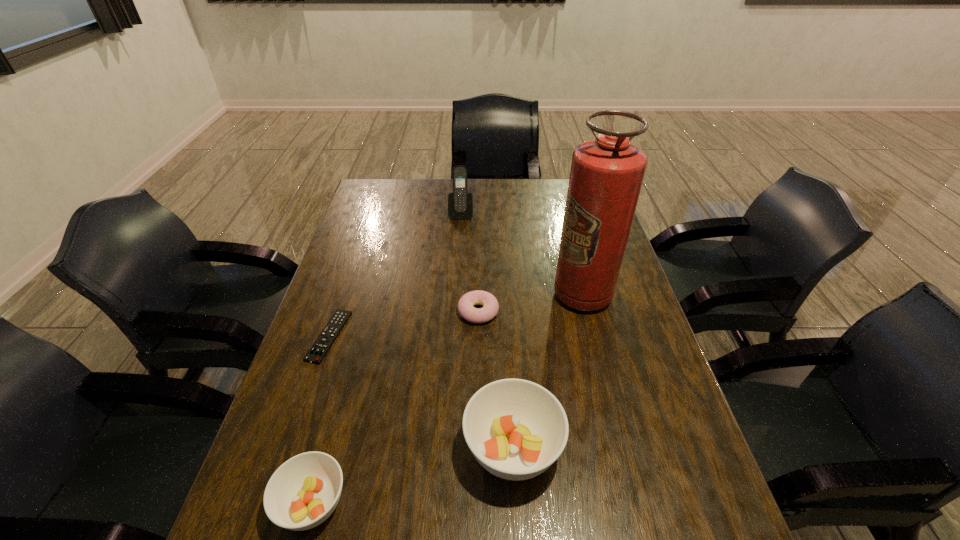
Identify the location of free space located on the label side of the rightmost object. Image resolution: width=960 pixels, height=540 pixels. (435, 294).

This screenshot has width=960, height=540. I want to click on vacant space located on the label side of the rightmost object, so click(x=435, y=294).

You are a GUI agent. You are given a task and a screenshot of the screen. Output one action in this format:
    pyautogui.click(x=<x>, y=<y>)
    Task: Click on the free space located 0.280m on the label side of the rightmost object
    
    Given the screenshot: What is the action you would take?
    pyautogui.click(x=458, y=294)

You are a GUI agent. You are given a task and a screenshot of the screen. Output one action in this format:
    pyautogui.click(x=<x>, y=<y>)
    Task: Click on the vacant space situated 0.200m on the left of the doughnut
    
    Given the screenshot: What is the action you would take?
    pyautogui.click(x=387, y=312)

This screenshot has width=960, height=540. In order to click on vacant space located on the right of the shortest object in this screenshot , I will do `click(469, 336)`.

Where is `object at the far edge`? object at the far edge is located at coordinates pyautogui.click(x=460, y=203).

Where is `object located in the near edge section of the desktop`? Image resolution: width=960 pixels, height=540 pixels. object located in the near edge section of the desktop is located at coordinates (516, 429).

Image resolution: width=960 pixels, height=540 pixels. I want to click on object that is at the left edge, so click(317, 352).

Locate an element on the screen. The width and height of the screenshot is (960, 540). object positioned at the right edge is located at coordinates (606, 176).

Where is `free space at the far edge`? The width and height of the screenshot is (960, 540). free space at the far edge is located at coordinates (426, 188).